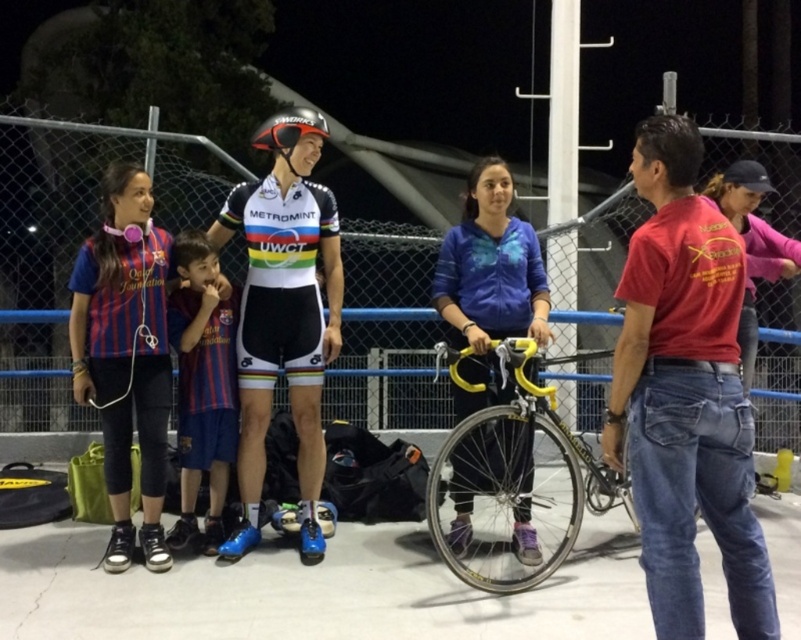
Question: Which of these objects is positioned farthest from the shiny orange helmet at center?

Choices:
 (A) red cotton shirt at right
 (B) yellow metallic bicycle at center
 (C) pink cotton shirt at right
 (D) rainbow jersey at center

Answer: (C)

Question: Does blue textured jacket at center appear under shiny orange helmet at center?

Choices:
 (A) yes
 (B) no

Answer: (A)

Question: Which point is closer to the camera?

Choices:
 (A) blue textured jacket at center
 (B) pink cotton shirt at right

Answer: (A)

Question: Which of the following is the farthest from the observer?

Choices:
 (A) rainbow jersey at center
 (B) yellow metallic bicycle at center
 (C) blue textured jacket at center

Answer: (A)

Question: Does red cotton shirt at right have a lesser width compared to striped jersey at left?

Choices:
 (A) yes
 (B) no

Answer: (B)

Question: Can you confirm if pink cotton shirt at right is smaller than shiny orange helmet at center?

Choices:
 (A) yes
 (B) no

Answer: (B)